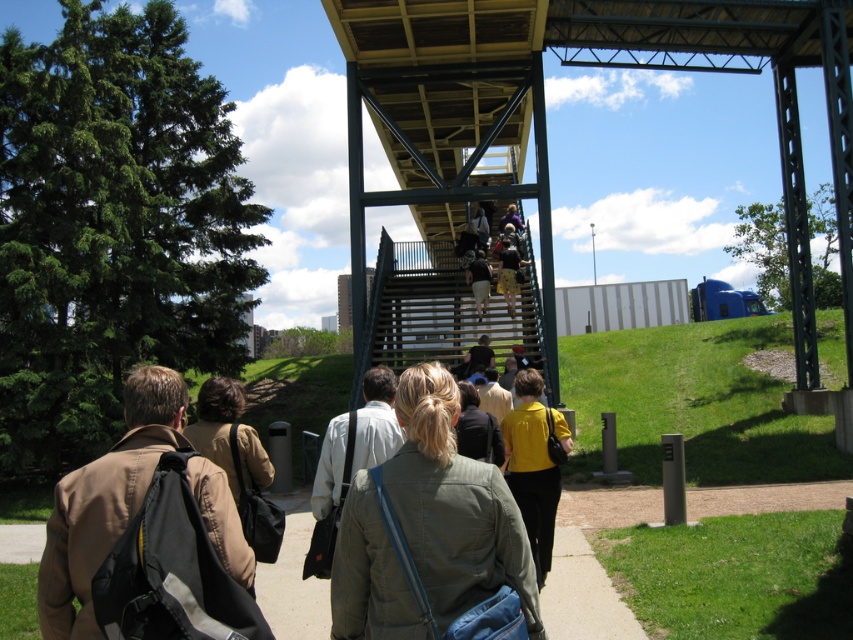
Question: Does brown leather jacket at lower left appear on the right side of yellow matte shirt at center?

Choices:
 (A) yes
 (B) no

Answer: (B)

Question: Can you confirm if brown leather jacket at lower left is positioned below yellow matte shirt at center?

Choices:
 (A) no
 (B) yes

Answer: (A)

Question: Is brown leather jacket at lower left to the right of yellow matte shirt at center from the viewer's perspective?

Choices:
 (A) yes
 (B) no

Answer: (B)